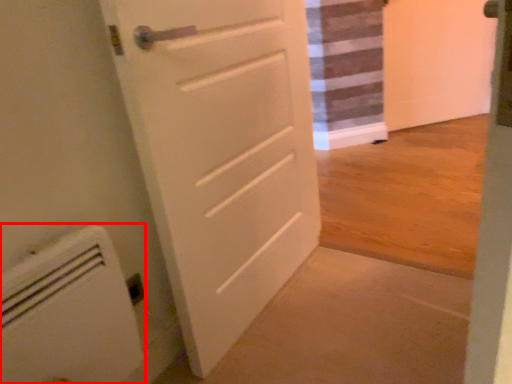
Question: From the image's perspective, where is appliance (annotated by the red box) located in relation to door in the image?

Choices:
 (A) above
 (B) below

Answer: (B)